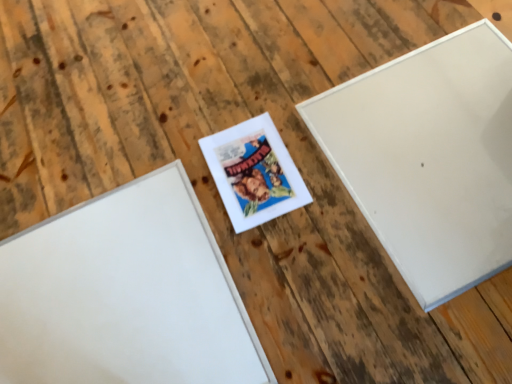
You are a GUI agent. You are given a task and a screenshot of the screen. Output one action in this format:
    pyautogui.click(x=<x>, y=<y>)
    Task: Click on the free space to the left of matte white picture frame at center, positioned as the second picture frame in right-to-left order
    
    Given the screenshot: What is the action you would take?
    pyautogui.click(x=170, y=199)